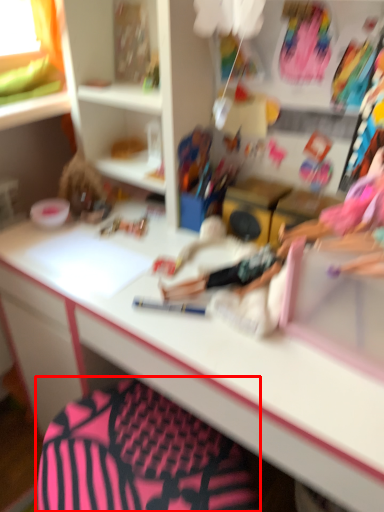
Question: From the image's perspective, what is the correct spatial relationship of swivel chair (annotated by the red box) in relation to desk?

Choices:
 (A) above
 (B) below

Answer: (B)